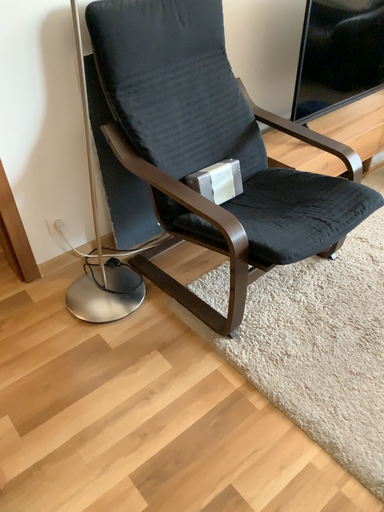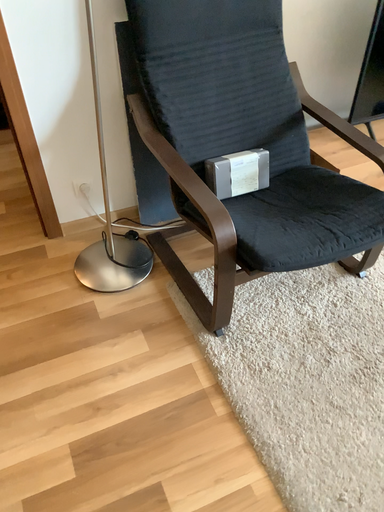
Question: Which way did the camera rotate in the video?

Choices:
 (A) rotated right
 (B) rotated left

Answer: (B)